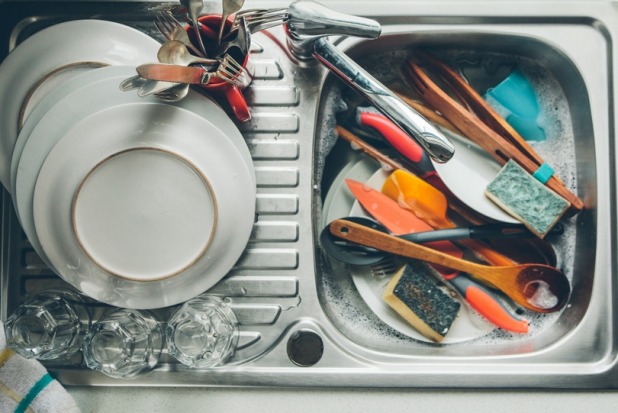
At what (x,y) coordinates should I click in order to perform the action: click on plates. Please return your answer as a coordinate pair (x, y). Looking at the image, I should click on [101, 146], [82, 111], [75, 85], [64, 42].